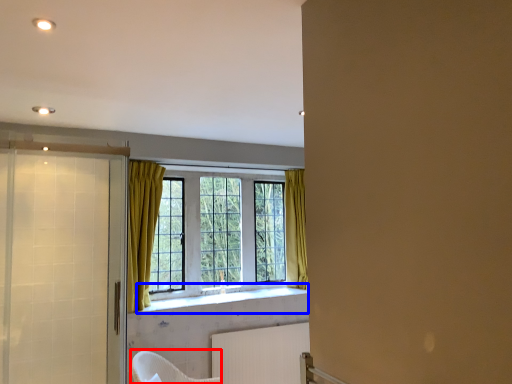
Question: Among these objects, which one is farthest to the camera, armchair (highlighted by a red box) or window sill (highlighted by a blue box)?

Choices:
 (A) armchair
 (B) window sill

Answer: (B)